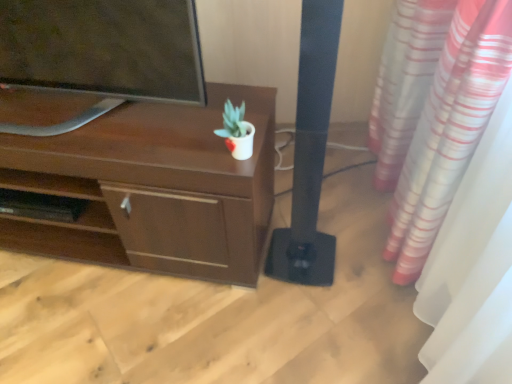
Where is `free space on the front side of black matte speaker at center`? The width and height of the screenshot is (512, 384). free space on the front side of black matte speaker at center is located at coordinates (305, 312).